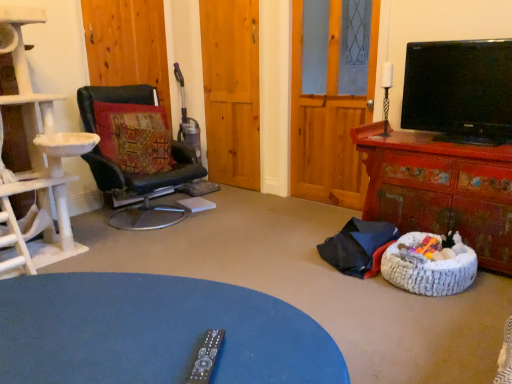
Where is `vacant area to the right of black plastic remote at center`? The image size is (512, 384). vacant area to the right of black plastic remote at center is located at coordinates (276, 354).